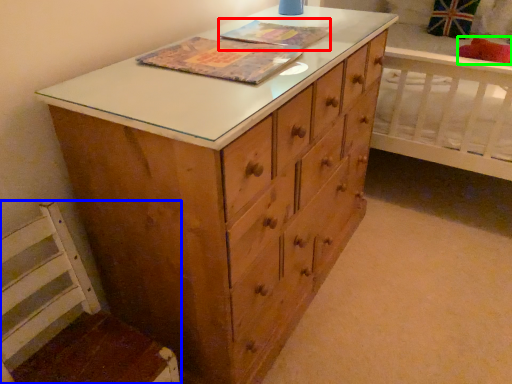
Question: Based on their relative distances, which object is nearer to book cover (highlighted by a red box)? Choose from swivel chair (highlighted by a blue box) and pillow (highlighted by a green box).

Choices:
 (A) swivel chair
 (B) pillow

Answer: (A)